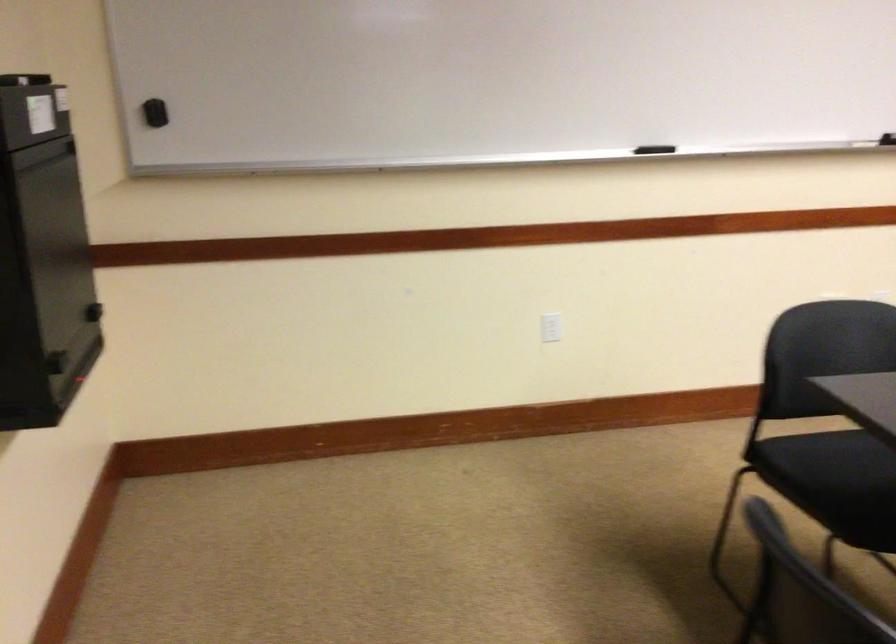
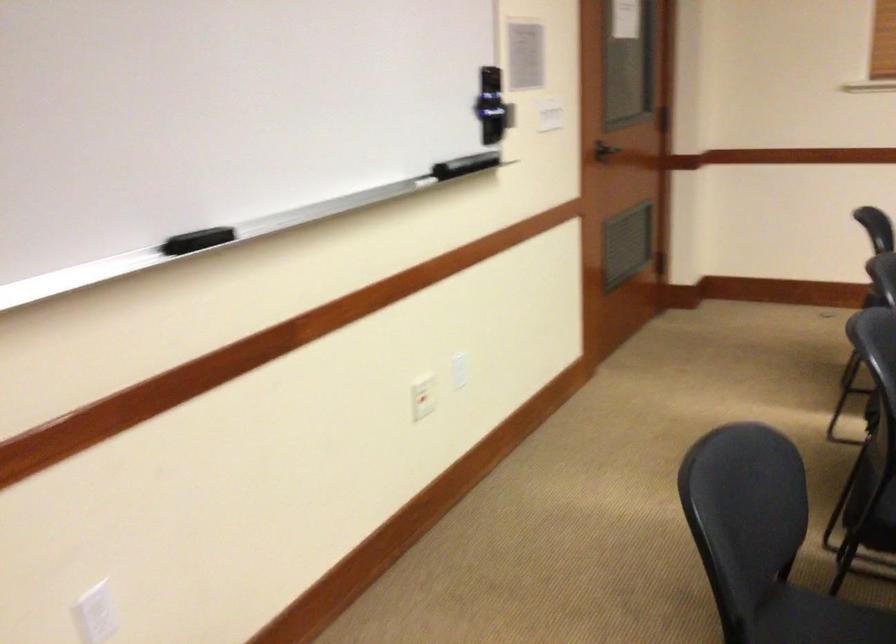
Question: What movement of the cameraman would produce the second image?

Choices:
 (A) Left
 (B) Right
 (C) Forward
 (D) Backward

Answer: (D)